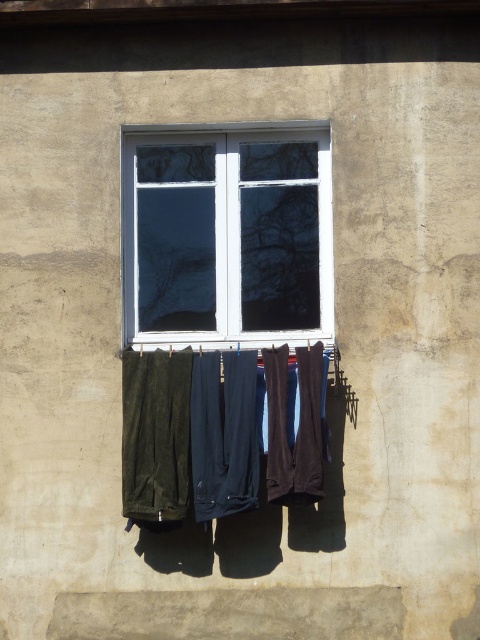
You are standing in front of the building and want to take a photo of the white plastic window at center. Where should you position yourself to ensure the window is centered in your camera viewfinder?

To center the white plastic window at center in your camera viewfinder, position yourself directly in front of the building at the point corresponding to its 2D coordinates at (228, 237).